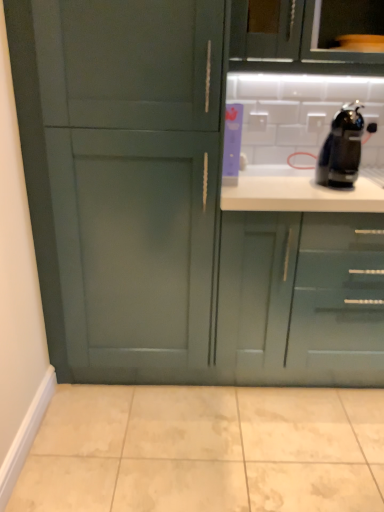
Question: Considering the relative sizes of black glossy coffee machine at upper right and green matte cabinet at upper center, the second cabinetry in the left-to-right sequence, in the image provided, is black glossy coffee machine at upper right bigger than green matte cabinet at upper center, the second cabinetry in the left-to-right sequence,?

Choices:
 (A) yes
 (B) no

Answer: (B)

Question: Considering the relative sizes of black glossy coffee machine at upper right and green matte cabinet at upper center, which is the second cabinetry in right-to-left order, in the image provided, is black glossy coffee machine at upper right smaller than green matte cabinet at upper center, which is the second cabinetry in right-to-left order,?

Choices:
 (A) yes
 (B) no

Answer: (A)

Question: Is black glossy coffee machine at upper right at the left side of green matte cabinet at upper center, which is the second cabinetry in right-to-left order?

Choices:
 (A) no
 (B) yes

Answer: (A)

Question: Does black glossy coffee machine at upper right have a lesser width compared to green matte cabinet at upper center, which is the second cabinetry in right-to-left order?

Choices:
 (A) no
 (B) yes

Answer: (B)

Question: Is black glossy coffee machine at upper right not close to green matte cabinet at upper center, which is the second cabinetry in right-to-left order?

Choices:
 (A) yes
 (B) no

Answer: (B)

Question: Is green matte cabinet at upper center, which is the second cabinetry in right-to-left order, completely or partially inside black glossy coffee machine at upper right?

Choices:
 (A) no
 (B) yes

Answer: (A)

Question: Is the depth of beige marble tile at lower center greater than that of glossy teal cabinet at lower right, marked as the 3th cabinetry in a left-to-right arrangement?

Choices:
 (A) no
 (B) yes

Answer: (A)

Question: Is beige marble tile at lower center positioned before glossy teal cabinet at lower right, marked as the 1th cabinetry in a right-to-left arrangement?

Choices:
 (A) no
 (B) yes

Answer: (B)

Question: Does beige marble tile at lower center have a larger size compared to glossy teal cabinet at lower right, marked as the 3th cabinetry in a left-to-right arrangement?

Choices:
 (A) no
 (B) yes

Answer: (A)

Question: Is beige marble tile at lower center directly adjacent to glossy teal cabinet at lower right, marked as the 1th cabinetry in a right-to-left arrangement?

Choices:
 (A) yes
 (B) no

Answer: (B)

Question: Is beige marble tile at lower center aimed at glossy teal cabinet at lower right, marked as the 1th cabinetry in a right-to-left arrangement?

Choices:
 (A) yes
 (B) no

Answer: (B)

Question: Does beige marble tile at lower center have a greater height compared to glossy teal cabinet at lower right, marked as the 3th cabinetry in a left-to-right arrangement?

Choices:
 (A) no
 (B) yes

Answer: (A)

Question: Is green matte cabinet at upper center, which is the second cabinetry in right-to-left order, at the left side of black glossy coffee machine at upper right?

Choices:
 (A) yes
 (B) no

Answer: (A)